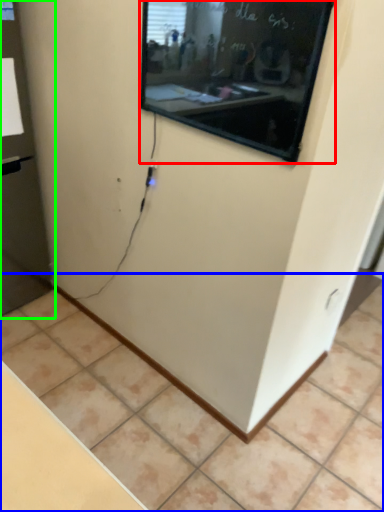
Question: Considering the real-world distances, which object is closest to projection screen (highlighted by a red box)? tile (highlighted by a blue box) or glass door (highlighted by a green box).

Choices:
 (A) tile
 (B) glass door

Answer: (B)